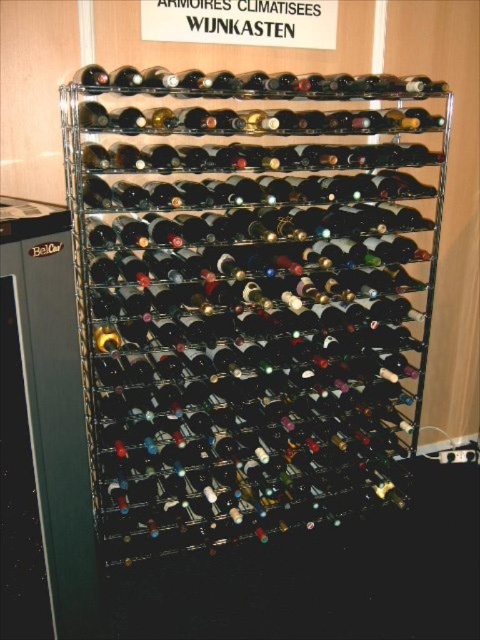
Question: Does black metal wine rack at center come behind matte black wine bottle at center?

Choices:
 (A) no
 (B) yes

Answer: (A)

Question: Which of the following is the farthest from the observer?

Choices:
 (A) matte black wine bottle at center
 (B) black metal wine rack at center

Answer: (A)

Question: Which point is closer to the camera?

Choices:
 (A) (97, 118)
 (B) (393, 444)

Answer: (A)

Question: Does black metal wine rack at center lie in front of matte black wine bottle at center?

Choices:
 (A) no
 (B) yes

Answer: (B)

Question: Among these objects, which one is nearest to the camera?

Choices:
 (A) black metal wine rack at center
 (B) matte black wine bottle at center

Answer: (A)

Question: From the image, what is the correct spatial relationship of black metal wine rack at center in relation to matte black wine bottle at center?

Choices:
 (A) right
 (B) left

Answer: (A)